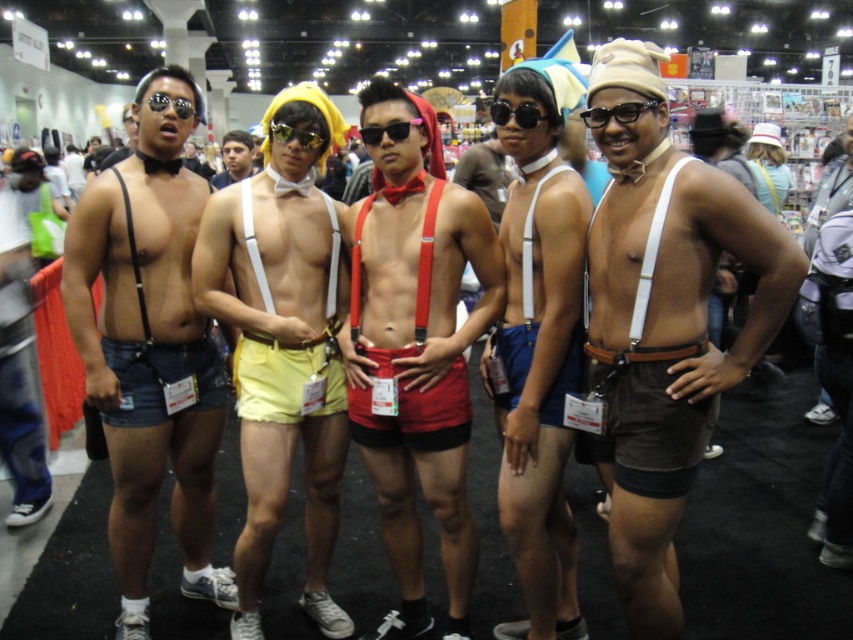
Who is positioned more to the right, matte white suspenders at center or black plastic goggles at center?

From the viewer's perspective, matte white suspenders at center appears more on the right side.

Who is more distant from viewer, (505,317) or (495,115)?

The point (505,317) is more distant.

Locate an element on the screen. This screenshot has height=640, width=853. matte white suspenders at center is located at coordinates (538, 358).

Can you confirm if red matte suspenders at center is wider than denim shorts at center?

No.

Can you confirm if red matte suspenders at center is positioned above denim shorts at center?

Actually, red matte suspenders at center is below denim shorts at center.

Between point (360, 108) and point (816, 355), which one is positioned behind?

Positioned behind is point (360, 108).

Where is `red matte suspenders at center`? This screenshot has width=853, height=640. red matte suspenders at center is located at coordinates (415, 348).

Can you confirm if denim shorts at left is smaller than red matte suspenders at center?

No.

Who is shorter, denim shorts at left or red matte suspenders at center?

Standing shorter between the two is red matte suspenders at center.

Is point (94, 216) closer to viewer compared to point (428, 182)?

Yes, point (94, 216) is in front of point (428, 182).

Locate an element on the screen. The height and width of the screenshot is (640, 853). denim shorts at left is located at coordinates (149, 346).